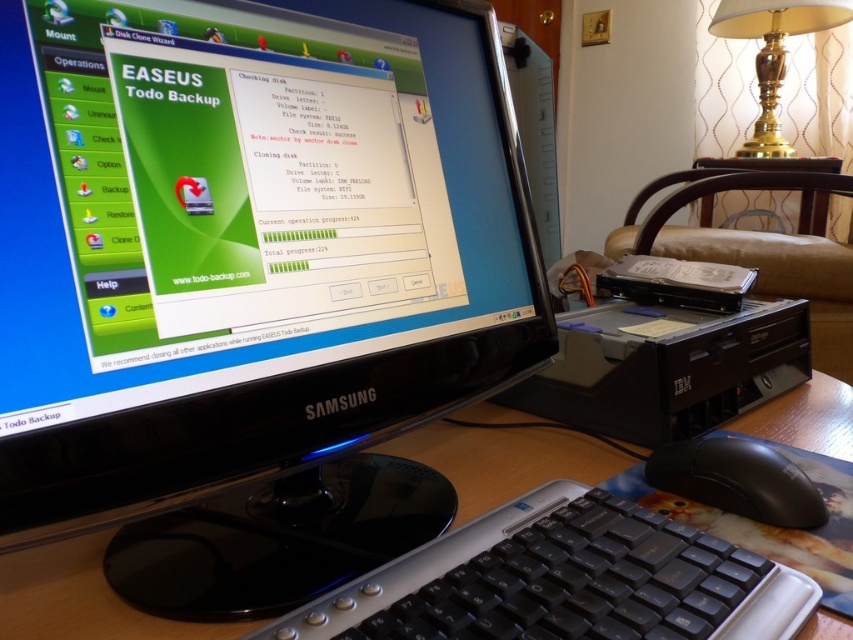
You are a technician trying to access the external hard drive located at point (215, 106). Can you reach it without moving your current position? The technician can extend their arm 45 centimeters.

The point (215, 106) is 40.30 centimeters from the viewer. Since the technician can extend their arm 45 centimeters, they can reach the external hard drive at point (215, 106).

You are setting up a new workstation and need to place the black plastic monitor at center and the black matte mouse at lower right on a desk. If the desk has a width of 1 meter, can both items fit side by side without overlapping?

The black plastic monitor at center is wider than the black matte mouse at lower right. However, since the desk is 1 meter wide, both items can fit side by side as long as their combined width does not exceed 1 meter. The exact fit depends on their individual widths, but since the monitor is only wider by an unspecified amount, it is possible if their total width is within the desk length.

You are setting up a home office and need to place a 25 cm wide laptop between the black plastic monitor at center and the camera. Is there enough space between them to fit the laptop?

The distance between the black plastic monitor at center and the camera is 30.67 centimeters. Since the laptop is 25 cm wide, there is enough space to fit it between them.